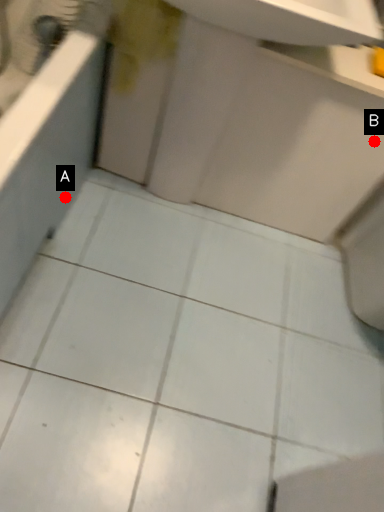
Question: Two points are circled on the image, labeled by A and B beside each circle. Which of the following is the closest to the observer?

Choices:
 (A) A is closer
 (B) B is closer

Answer: (B)